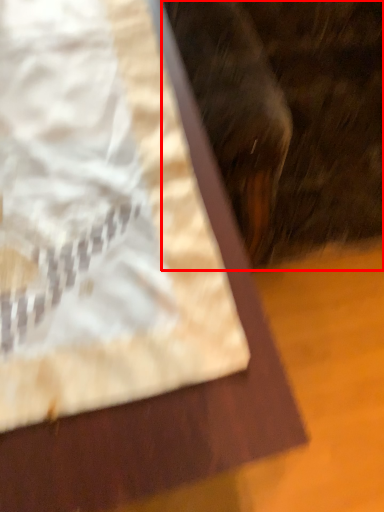
Question: From the image's perspective, considering the relative positions of animal (annotated by the red box) and sheet in the image provided, where is animal (annotated by the red box) located with respect to the staircase?

Choices:
 (A) below
 (B) above

Answer: (B)